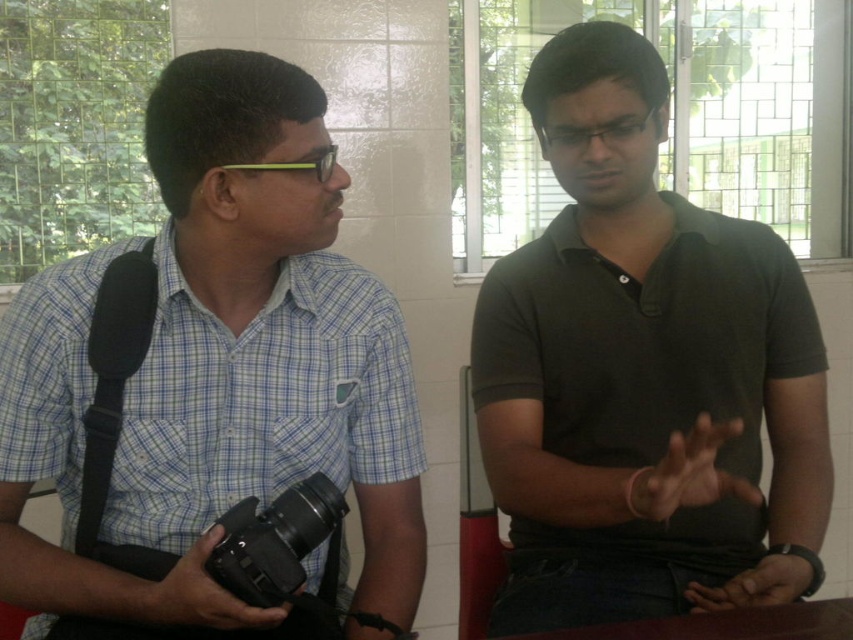
Question: Which object is the farthest from the blue checkered shirt at left?

Choices:
 (A) matte black camera at lower left
 (B) dark green polo shirt at center

Answer: (B)

Question: Considering the relative positions of dark green polo shirt at center and matte black camera at lower left in the image provided, where is dark green polo shirt at center located with respect to matte black camera at lower left?

Choices:
 (A) above
 (B) below

Answer: (A)

Question: Is blue checkered shirt at left to the left of dark green polo shirt at center from the viewer's perspective?

Choices:
 (A) yes
 (B) no

Answer: (A)

Question: Which of the following is the closest to the observer?

Choices:
 (A) blue checkered shirt at left
 (B) dark green polo shirt at center

Answer: (B)

Question: Observing the image, what is the correct spatial positioning of blue checkered shirt at left in reference to dark green polo shirt at center?

Choices:
 (A) above
 (B) below

Answer: (B)

Question: Which object is the closest to the matte black camera at lower left?

Choices:
 (A) blue checkered shirt at left
 (B) dark green polo shirt at center

Answer: (A)